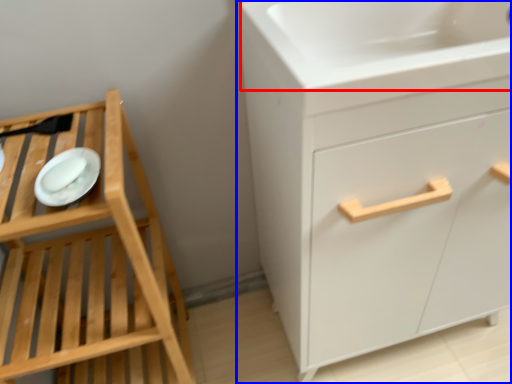
Question: Which object is further to the camera taking this photo, sink (highlighted by a red box) or chest of drawers (highlighted by a blue box)?

Choices:
 (A) sink
 (B) chest of drawers

Answer: (A)